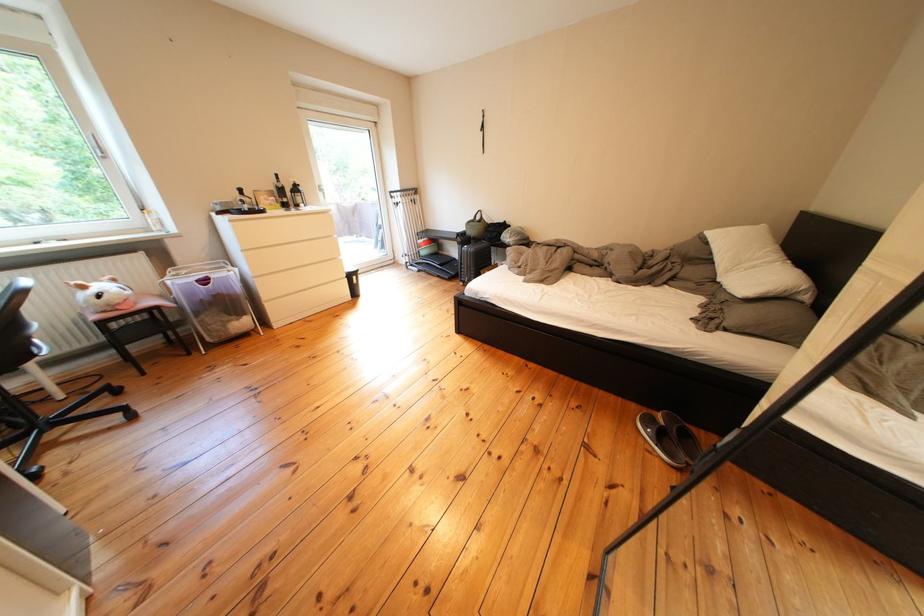
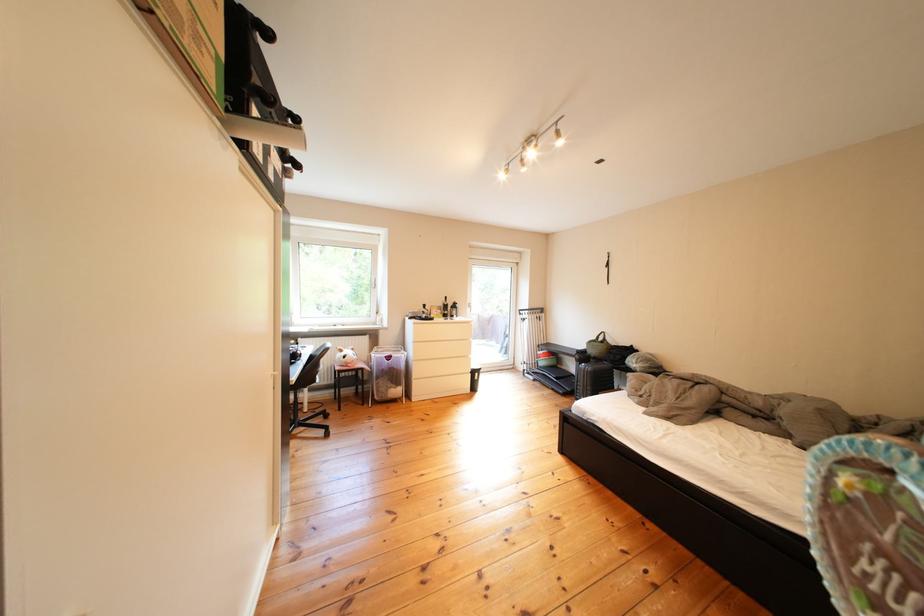
The point at [212,318] is marked in the first image. Where is the corresponding point in the second image?

(392, 382)